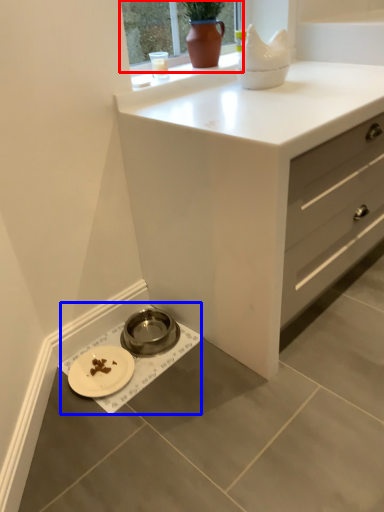
Question: Which object is further to the camera taking this photo, window frame (highlighted by a red box) or sink (highlighted by a blue box)?

Choices:
 (A) window frame
 (B) sink

Answer: (B)